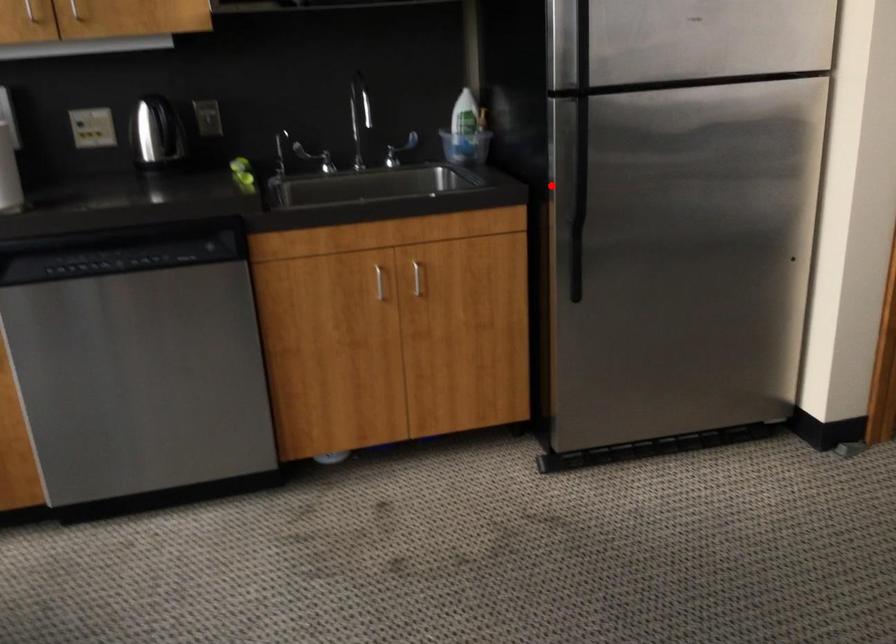
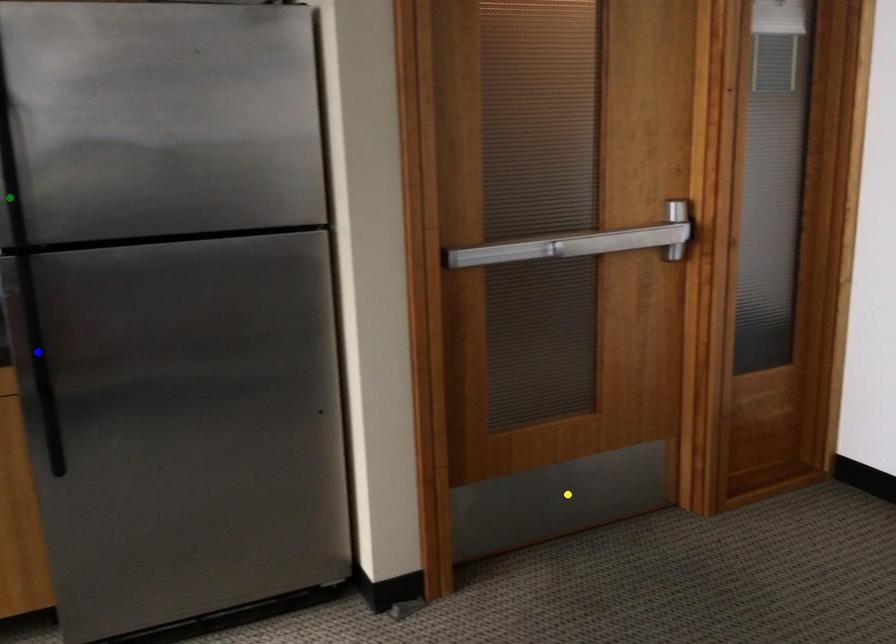
Question: I am providing you with two images of the same scene from different viewpoints. A red point is marked on the first image. You are given multiple points on the second image. In image 2, which mark is for the same physical point as the one in image 1?

Choices:
 (A) blue point
 (B) yellow point
 (C) green point

Answer: (A)